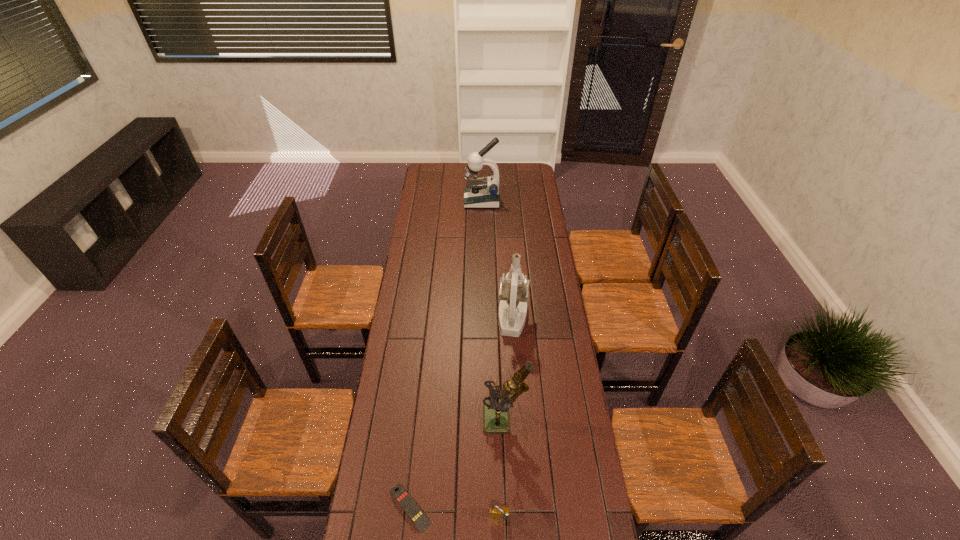
Identify which object is the fourth closest to the farthest object. Please provide its 2D coordinates. Your answer should be formatted as a tuple, i.e. [(x, y)], where the tuple contains the x and y coordinates of a point satisfying the conditions above.

[(496, 512)]

Locate which object ranks fourth in proximity to the remote control. Please provide its 2D coordinates. Your answer should be formatted as a tuple, i.e. [(x, y)], where the tuple contains the x and y coordinates of a point satisfying the conditions above.

[(483, 192)]

Locate an element on the screen. This screenshot has height=540, width=960. microscope that is the third closest one to the padlock is located at coordinates (483, 192).

Identify which microscope is located as the nearest to the third farthest object. Please provide its 2D coordinates. Your answer should be formatted as a tuple, i.e. [(x, y)], where the tuple contains the x and y coordinates of a point satisfying the conditions above.

[(514, 288)]

This screenshot has width=960, height=540. In order to click on free location that satisfies the following two spatial constraints: 1. at the eyepiece of the second nearest microscope; 2. on the left side of the farthest microscope in this screenshot , I will do `click(483, 318)`.

Locate an element on the screen. The width and height of the screenshot is (960, 540). vacant space that satisfies the following two spatial constraints: 1. at the eyepiece of the nearest microscope; 2. on the side with the combination dials of the second shortest object is located at coordinates (510, 519).

Where is `free space in the image that satisfies the following two spatial constraints: 1. at the eyepiece of the third nearest object; 2. on the side with the combination dials of the padlock`? free space in the image that satisfies the following two spatial constraints: 1. at the eyepiece of the third nearest object; 2. on the side with the combination dials of the padlock is located at coordinates (510, 519).

In order to click on free space that satisfies the following two spatial constraints: 1. on the back side of the second nearest microscope; 2. at the eyepiece of the farthest object in this screenshot , I will do `click(504, 201)`.

In order to click on free location that satisfies the following two spatial constraints: 1. at the eyepiece of the fourth nearest object; 2. on the right side of the farthest microscope in this screenshot , I will do `click(483, 318)`.